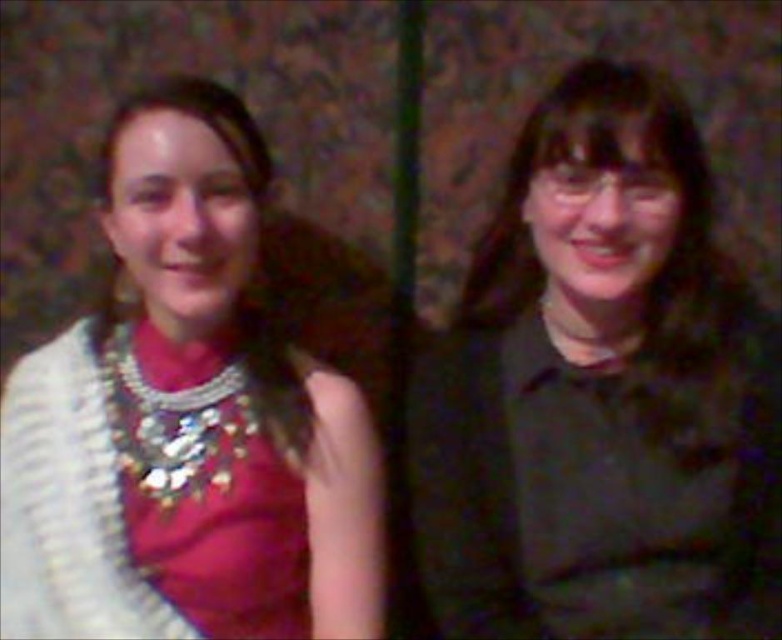
Question: Estimate the real-world distances between objects in this image. Which object is farther from the shiny silver necklace at left?

Choices:
 (A) shiny metallic necklace at left
 (B) dark green shirt at right

Answer: (B)

Question: Which point is closer to the camera taking this photo?

Choices:
 (A) (504, 381)
 (B) (52, 552)
 (C) (260, 556)

Answer: (C)

Question: Can you confirm if dark green shirt at right is wider than shiny silver necklace at left?

Choices:
 (A) yes
 (B) no

Answer: (A)

Question: Estimate the real-world distances between objects in this image. Which object is farther from the dark green shirt at right?

Choices:
 (A) shiny metallic necklace at left
 (B) shiny silver necklace at left

Answer: (A)

Question: Does dark green shirt at right have a greater width compared to shiny silver necklace at left?

Choices:
 (A) yes
 (B) no

Answer: (A)

Question: Is dark green shirt at right bigger than shiny metallic necklace at left?

Choices:
 (A) no
 (B) yes

Answer: (B)